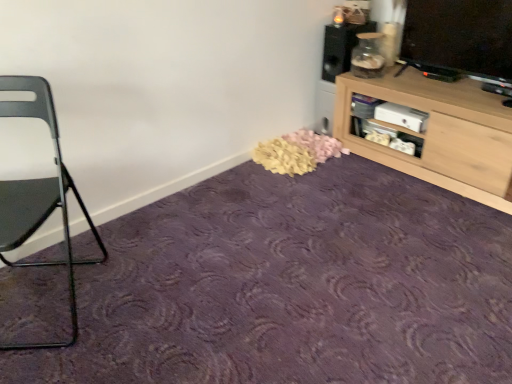
Question: Considering their positions, is matte black speaker at upper right located in front of or behind metallic gray chair at left?

Choices:
 (A) behind
 (B) front

Answer: (A)

Question: Is matte black speaker at upper right taller or shorter than metallic gray chair at left?

Choices:
 (A) short
 (B) tall

Answer: (A)

Question: Which object is the farthest from the purple carpet at center?

Choices:
 (A) metallic gray chair at left
 (B) matte black speaker at upper right
 (C) light wood cabinet at upper right

Answer: (B)

Question: Based on their relative distances, which object is farther from the metallic gray chair at left?

Choices:
 (A) purple carpet at center
 (B) matte black speaker at upper right
 (C) light wood cabinet at upper right

Answer: (B)